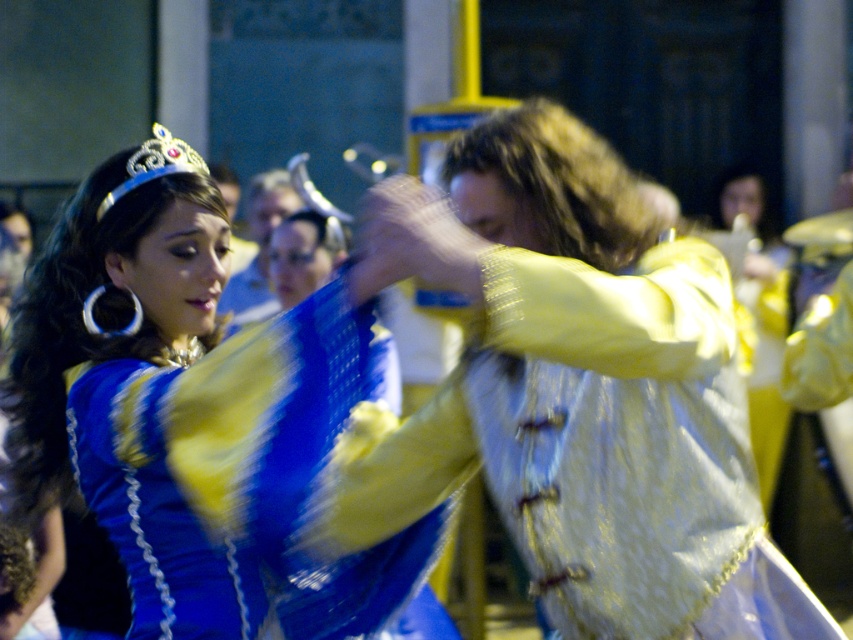
Who is taller, blue satin dress at left or silver metallic crown at upper left?

With more height is blue satin dress at left.

Can you confirm if blue satin dress at left is bigger than silver metallic crown at upper left?

No, blue satin dress at left is not bigger than silver metallic crown at upper left.

Does point (392, 604) come behind point (181, 168)?

Yes.

This screenshot has width=853, height=640. I want to click on blue satin dress at left, so click(193, 419).

Is point (376, 216) more distant than point (38, 483)?

No, (376, 216) is in front of (38, 483).

Who is more distant from viewer, (508, 131) or (323, 298)?

The point (508, 131) is more distant.

Where is `shiny blue fabric at center`? shiny blue fabric at center is located at coordinates (579, 392).

You are a GUI agent. You are given a task and a screenshot of the screen. Output one action in this format:
    pyautogui.click(x=<x>, y=<y>)
    Task: Click on the shiny blue fabric at center
    Image resolution: width=853 pixels, height=640 pixels.
    Given the screenshot: What is the action you would take?
    pyautogui.click(x=579, y=392)

Measure the distance between shiny blue fabric at center and silver metallic crown at upper left.

shiny blue fabric at center is 28.67 feet from silver metallic crown at upper left.

Can you confirm if shiny blue fabric at center is smaller than silver metallic crown at upper left?

Actually, shiny blue fabric at center might be larger than silver metallic crown at upper left.

Who is more forward, (573, 403) or (135, 163)?

Positioned in front is point (573, 403).

In order to click on shiny blue fabric at center in this screenshot , I will do `click(579, 392)`.